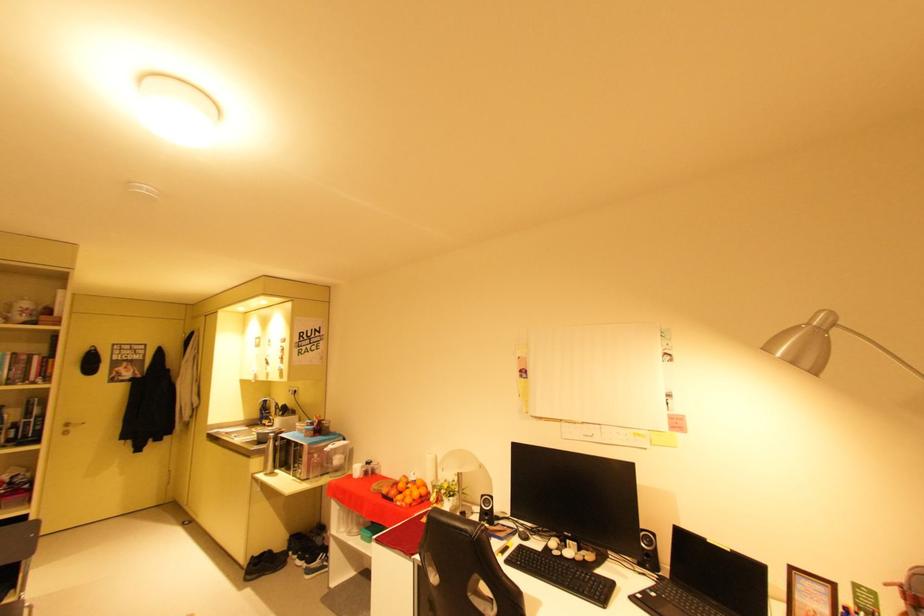
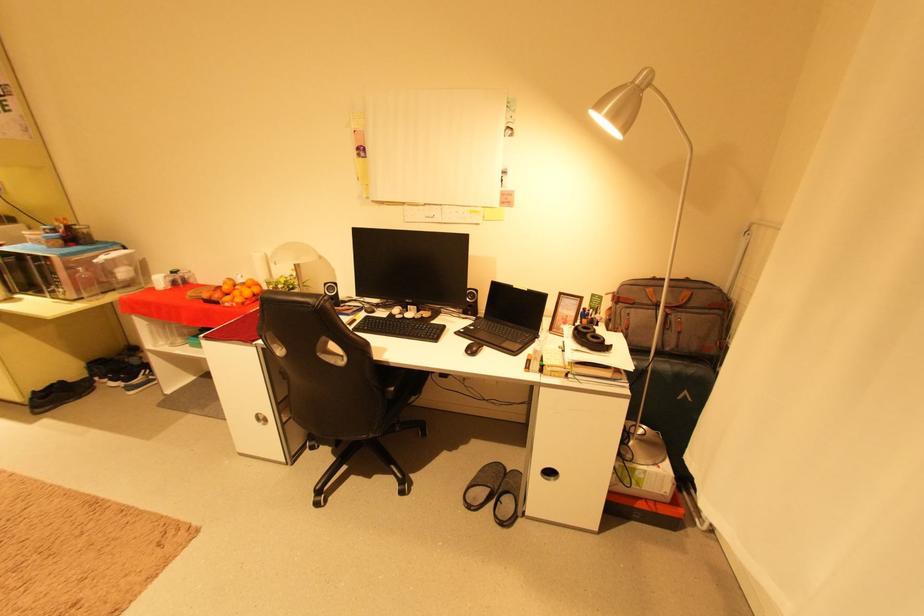
The point at [817,323] is marked in the first image. Where is the corresponding point in the second image?

(639, 83)